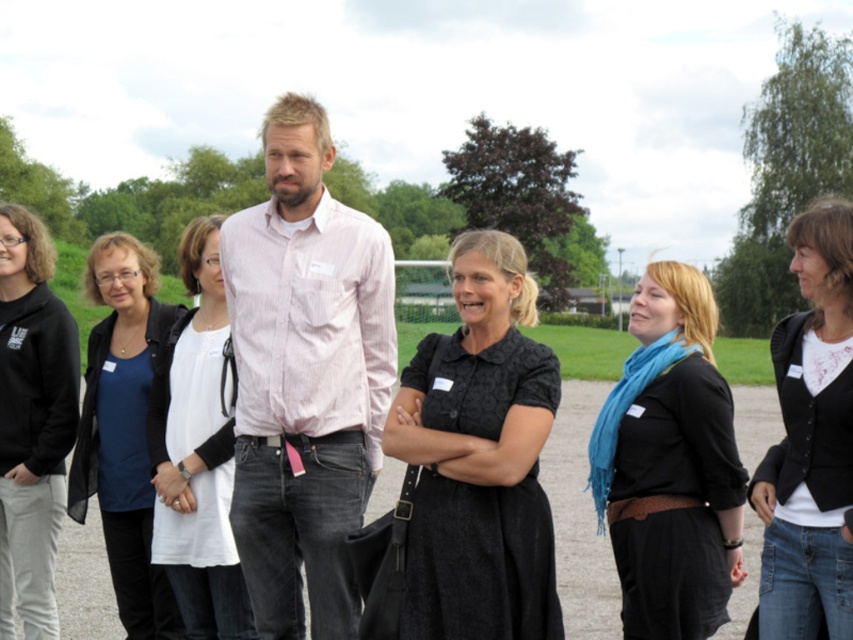
Question: Is black fleece at left wider than matte black shirt at center?

Choices:
 (A) no
 (B) yes

Answer: (A)

Question: Is pink striped shirt at center closer to the viewer compared to black matte jacket at right?

Choices:
 (A) yes
 (B) no

Answer: (B)

Question: Which of the following is the farthest from the observer?

Choices:
 (A) black textured dress at center
 (B) black matte jacket at right

Answer: (A)

Question: Which point is farther to the camera?

Choices:
 (A) pink striped shirt at center
 (B) white cotton dress at center
 (C) black matte scarf at center
 (D) matte black shirt at center

Answer: (D)

Question: Does black textured dress at center appear on the right side of black matte jacket at right?

Choices:
 (A) yes
 (B) no

Answer: (B)

Question: Among these points, which one is farthest from the camera?

Choices:
 (A) (86, 378)
 (B) (305, 180)
 (C) (432, 538)

Answer: (A)